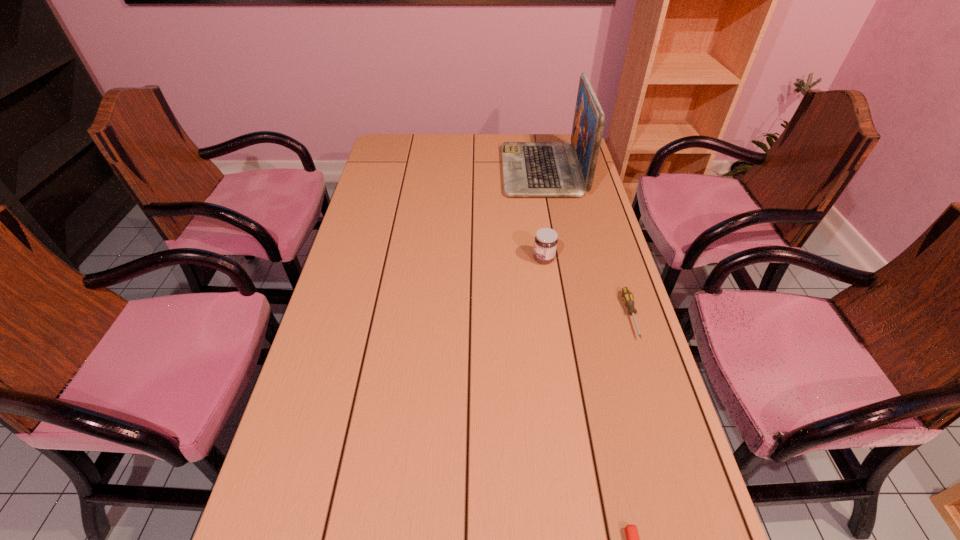
This screenshot has height=540, width=960. I want to click on the tallest object, so click(530, 169).

You are a GUI agent. You are given a task and a screenshot of the screen. Output one action in this format:
    pyautogui.click(x=<x>, y=<y>)
    Task: Click on the farthest object
    The height and width of the screenshot is (540, 960).
    Given the screenshot: What is the action you would take?
    pyautogui.click(x=530, y=169)

Find the location of a particular element. the second farthest object is located at coordinates coord(545,244).

Locate an element on the screen. the second tallest object is located at coordinates (545, 244).

Find the location of a particular element. Image resolution: width=960 pixels, height=540 pixels. the taller screwdriver is located at coordinates (627, 296).

Locate an element on the screen. Image resolution: width=960 pixels, height=540 pixels. the right screwdriver is located at coordinates (627, 296).

Locate an element on the screen. The image size is (960, 540). free space located on the screen of the tallest object is located at coordinates (432, 171).

Identify the location of free space located 0.190m on the screen of the tallest object. (453, 171).

Find the location of a particular element. The height and width of the screenshot is (540, 960). free region located on the screen of the tallest object is located at coordinates (426, 171).

Where is `vacant region located 0.210m on the front label of the third shortest object`? This screenshot has height=540, width=960. vacant region located 0.210m on the front label of the third shortest object is located at coordinates (463, 259).